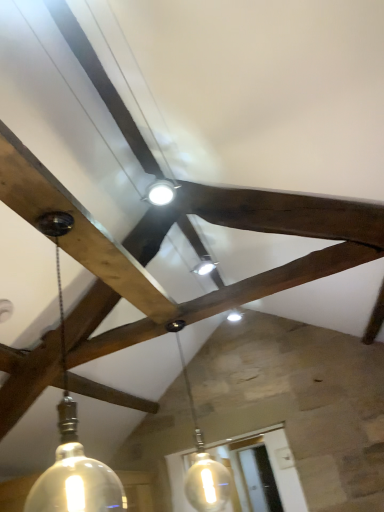
How much space does matte glass pendant light at left, acting as the first lamp starting from the front, occupy vertically?

30.10 inches.

Image resolution: width=384 pixels, height=512 pixels. Describe the element at coordinates (72, 434) in the screenshot. I see `matte glass pendant light at left, acting as the first lamp starting from the front` at that location.

The image size is (384, 512). Find the location of `matte glass pendant light at left, acting as the first lamp starting from the front`. matte glass pendant light at left, acting as the first lamp starting from the front is located at coordinates (72, 434).

In order to face matte glass pendant light at left, acting as the first lamp starting from the front, should I rotate leftwards or rightwards?

You should look left and rotate roughly 16.104 degrees.

What do you see at coordinates (202, 457) in the screenshot? The height and width of the screenshot is (512, 384). I see `translucent glass pendant light at center, positioned as the first lamp in back-to-front order` at bounding box center [202, 457].

This screenshot has height=512, width=384. Find the location of `translucent glass pendant light at center, the 2th lamp viewed from the front`. translucent glass pendant light at center, the 2th lamp viewed from the front is located at coordinates (202, 457).

Find the location of a particular element. matte glass pendant light at left, acting as the first lamp starting from the front is located at coordinates (72, 434).

Which is more to the right, matte glass pendant light at left, which is the 2th lamp from back to front, or translucent glass pendant light at center, the 2th lamp viewed from the front?

translucent glass pendant light at center, the 2th lamp viewed from the front.

Is the depth of matte glass pendant light at left, acting as the first lamp starting from the front, greater than that of translucent glass pendant light at center, positioned as the first lamp in back-to-front order?

No, it is not.

Between point (97, 498) and point (196, 473), which one is positioned behind?

The point (196, 473) is more distant.

From the image's perspective, which is below, matte glass pendant light at left, which is the 2th lamp from back to front, or translucent glass pendant light at center, the 2th lamp viewed from the front?

translucent glass pendant light at center, the 2th lamp viewed from the front, is shown below in the image.

From a real-world perspective, is matte glass pendant light at left, which is the 2th lamp from back to front, above or below translucent glass pendant light at center, the 2th lamp viewed from the front?

In terms of real-world spatial position, matte glass pendant light at left, which is the 2th lamp from back to front, is above translucent glass pendant light at center, the 2th lamp viewed from the front.

From the picture: Considering the relative sizes of matte glass pendant light at left, which is the 2th lamp from back to front, and translucent glass pendant light at center, positioned as the first lamp in back-to-front order, in the image provided, is matte glass pendant light at left, which is the 2th lamp from back to front, wider than translucent glass pendant light at center, positioned as the first lamp in back-to-front order,?

Indeed, matte glass pendant light at left, which is the 2th lamp from back to front, has a greater width compared to translucent glass pendant light at center, positioned as the first lamp in back-to-front order.

Is matte glass pendant light at left, acting as the first lamp starting from the front, taller or shorter than translucent glass pendant light at center, the 2th lamp viewed from the front?

matte glass pendant light at left, acting as the first lamp starting from the front, is shorter than translucent glass pendant light at center, the 2th lamp viewed from the front.

Can you confirm if matte glass pendant light at left, acting as the first lamp starting from the front, is smaller than translucent glass pendant light at center, positioned as the first lamp in back-to-front order?

Yes.

Which is correct: matte glass pendant light at left, acting as the first lamp starting from the front, is inside translucent glass pendant light at center, positioned as the first lamp in back-to-front order, or outside of it?

matte glass pendant light at left, acting as the first lamp starting from the front, exists outside the volume of translucent glass pendant light at center, positioned as the first lamp in back-to-front order.

Is matte glass pendant light at left, which is the 2th lamp from back to front, positioned far away from translucent glass pendant light at center, the 2th lamp viewed from the front?

Yes, matte glass pendant light at left, which is the 2th lamp from back to front, and translucent glass pendant light at center, the 2th lamp viewed from the front, are quite far apart.

Does matte glass pendant light at left, which is the 2th lamp from back to front, turn towards translucent glass pendant light at center, positioned as the first lamp in back-to-front order?

Yes, matte glass pendant light at left, which is the 2th lamp from back to front, is turned towards translucent glass pendant light at center, positioned as the first lamp in back-to-front order.

How many degrees apart are the facing directions of matte glass pendant light at left, acting as the first lamp starting from the front, and translucent glass pendant light at center, positioned as the first lamp in back-to-front order?

There is a 0.000744-degree angle between the facing directions of matte glass pendant light at left, acting as the first lamp starting from the front, and translucent glass pendant light at center, positioned as the first lamp in back-to-front order.

How much distance is there between matte glass pendant light at left, acting as the first lamp starting from the front, and translucent glass pendant light at center, positioned as the first lamp in back-to-front order?

matte glass pendant light at left, acting as the first lamp starting from the front, and translucent glass pendant light at center, positioned as the first lamp in back-to-front order, are 6.89 feet apart.

Where is `lamp in front of the translucent glass pendant light at center, positioned as the first lamp in back-to-front order`? This screenshot has width=384, height=512. lamp in front of the translucent glass pendant light at center, positioned as the first lamp in back-to-front order is located at coordinates (72, 434).

Is translucent glass pendant light at center, the 2th lamp viewed from the front, to the left or to the right of matte glass pendant light at left, which is the 2th lamp from back to front, in the image?

From the image, it's evident that translucent glass pendant light at center, the 2th lamp viewed from the front, is to the right of matte glass pendant light at left, which is the 2th lamp from back to front.

Considering the positions of objects translucent glass pendant light at center, the 2th lamp viewed from the front, and matte glass pendant light at left, which is the 2th lamp from back to front, in the image provided, who is in front, translucent glass pendant light at center, the 2th lamp viewed from the front, or matte glass pendant light at left, which is the 2th lamp from back to front,?

matte glass pendant light at left, which is the 2th lamp from back to front.

Is point (222, 481) closer or farther from the camera than point (61, 439)?

Point (222, 481) is farther from the camera than point (61, 439).

In the scene shown: From the image's perspective, who appears lower, translucent glass pendant light at center, positioned as the first lamp in back-to-front order, or matte glass pendant light at left, acting as the first lamp starting from the front?

From the image's view, translucent glass pendant light at center, positioned as the first lamp in back-to-front order, is below.

From a real-world perspective, does translucent glass pendant light at center, the 2th lamp viewed from the front, stand above matte glass pendant light at left, acting as the first lamp starting from the front?

No, from a real-world perspective, translucent glass pendant light at center, the 2th lamp viewed from the front, is not above matte glass pendant light at left, acting as the first lamp starting from the front.

Which of these two, translucent glass pendant light at center, the 2th lamp viewed from the front, or matte glass pendant light at left, acting as the first lamp starting from the front, is thinner?

Thinner between the two is translucent glass pendant light at center, the 2th lamp viewed from the front.

Considering the sizes of objects translucent glass pendant light at center, the 2th lamp viewed from the front, and matte glass pendant light at left, which is the 2th lamp from back to front, in the image provided, who is taller, translucent glass pendant light at center, the 2th lamp viewed from the front, or matte glass pendant light at left, which is the 2th lamp from back to front,?

translucent glass pendant light at center, the 2th lamp viewed from the front.

Considering the sizes of translucent glass pendant light at center, positioned as the first lamp in back-to-front order, and matte glass pendant light at left, acting as the first lamp starting from the front, in the image, is translucent glass pendant light at center, positioned as the first lamp in back-to-front order, bigger or smaller than matte glass pendant light at left, acting as the first lamp starting from the front,?

Clearly, translucent glass pendant light at center, positioned as the first lamp in back-to-front order, is larger in size than matte glass pendant light at left, acting as the first lamp starting from the front.

Choose the correct answer: Is translucent glass pendant light at center, the 2th lamp viewed from the front, inside matte glass pendant light at left, which is the 2th lamp from back to front, or outside it?

translucent glass pendant light at center, the 2th lamp viewed from the front, lies outside matte glass pendant light at left, which is the 2th lamp from back to front.

Is translucent glass pendant light at center, the 2th lamp viewed from the front, not near matte glass pendant light at left, which is the 2th lamp from back to front?

translucent glass pendant light at center, the 2th lamp viewed from the front, is far away from matte glass pendant light at left, which is the 2th lamp from back to front.

Is translucent glass pendant light at center, the 2th lamp viewed from the front, facing away from matte glass pendant light at left, acting as the first lamp starting from the front?

That's right, translucent glass pendant light at center, the 2th lamp viewed from the front, is facing away from matte glass pendant light at left, acting as the first lamp starting from the front.

Find the location of a particular element. The width and height of the screenshot is (384, 512). lamp that appears behind the matte glass pendant light at left, which is the 2th lamp from back to front is located at coordinates (202, 457).

Identify the location of lamp on the right of matte glass pendant light at left, which is the 2th lamp from back to front. (202, 457).

I want to click on lamp above the translucent glass pendant light at center, the 2th lamp viewed from the front (from a real-world perspective), so click(72, 434).